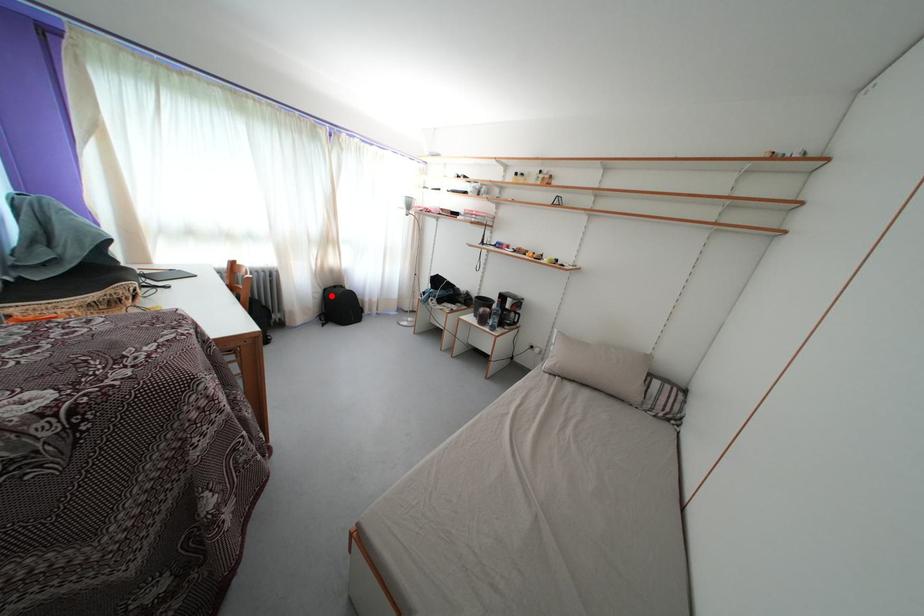
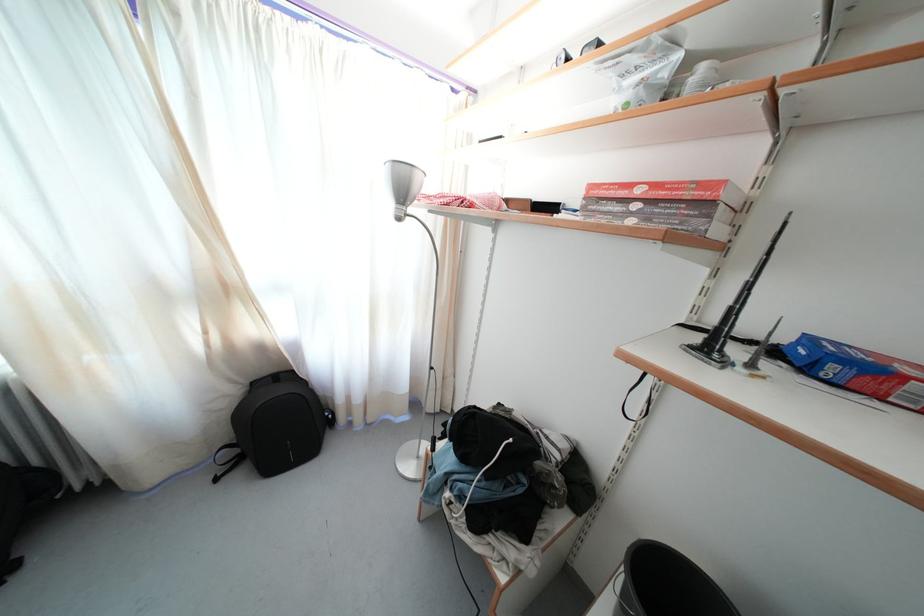
In the second image, find the point that corresponds to the highlighted location in the first image.

(259, 390)